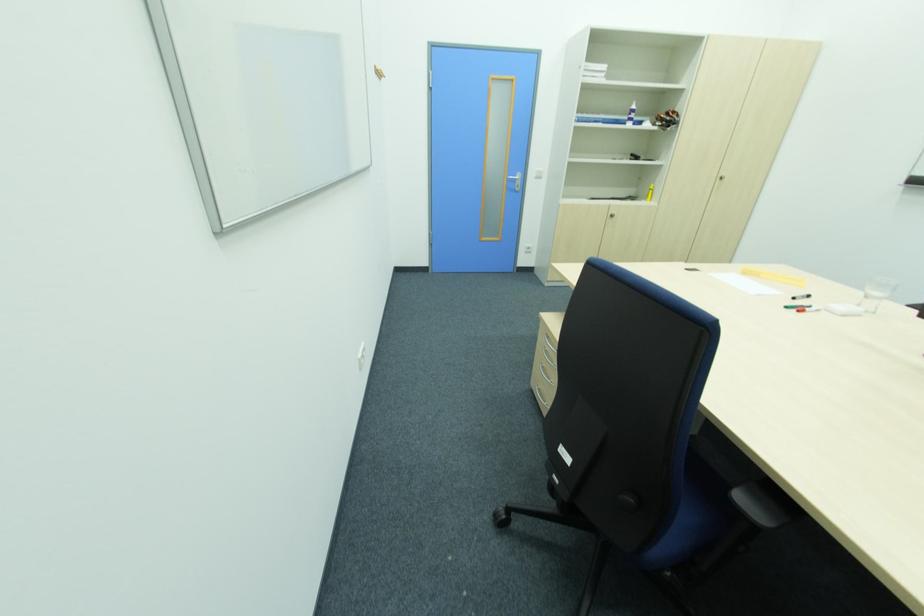
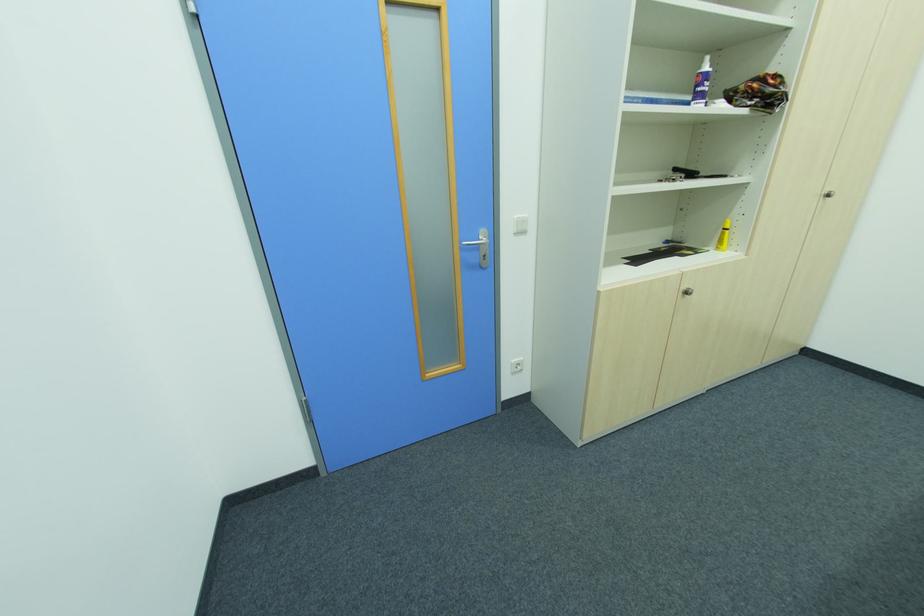
Find the pixel in the second image that matches the point at 636,111 in the first image.

(708, 78)